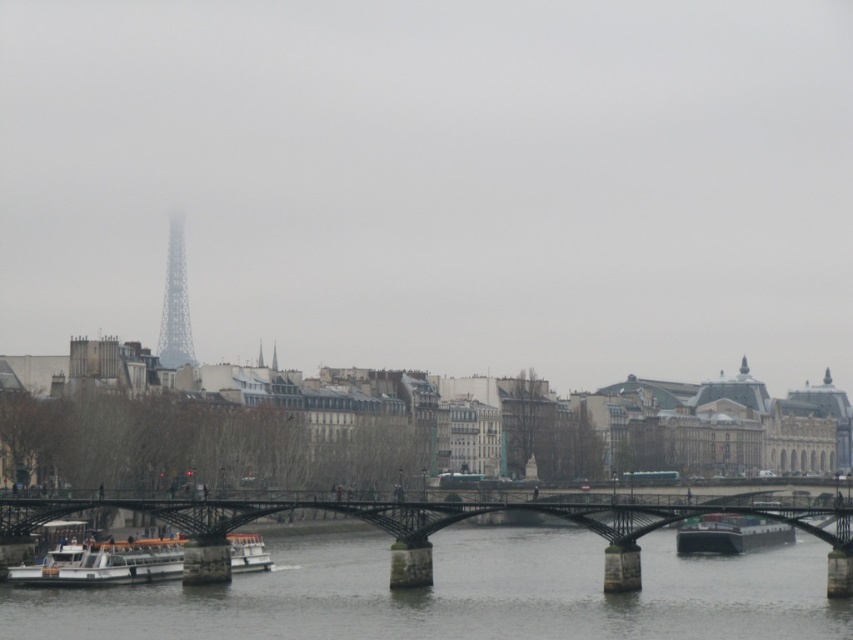
You are a photographer planning to capture a wide shot of the metallic bridge at center and the white matte boat at lower left from a position on the opposite bank. Considering their heights, which object will appear larger in the photo?

The metallic bridge at center will appear larger in the photo because it is much taller than the white matte boat at lower left.

From the picture: You are standing on the bridge in the foreground of the scene. You see the white matte boat at lower left and the metallic gray tower at upper left. Which object is positioned further to the right from your perspective?

The white matte boat at lower left is positioned to the right of the metallic gray tower at upper left, so the white matte boat at lower left is further to the right.